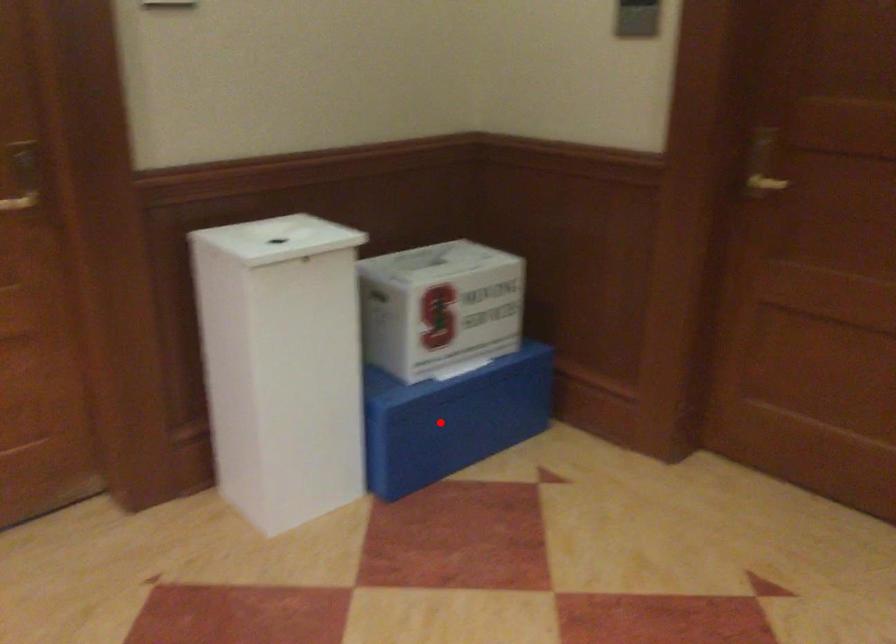
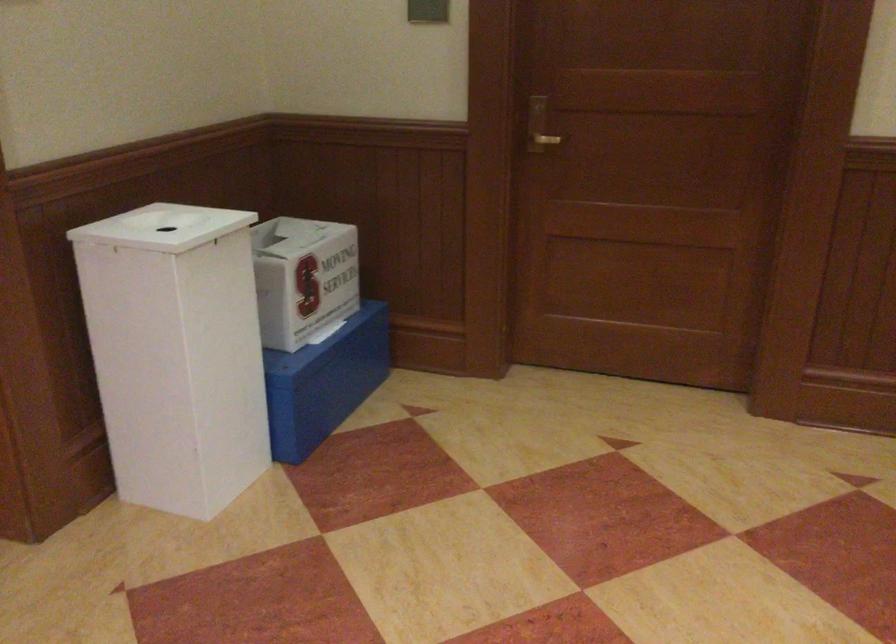
Find the pixel in the second image that matches the highlighted location in the first image.

(323, 382)